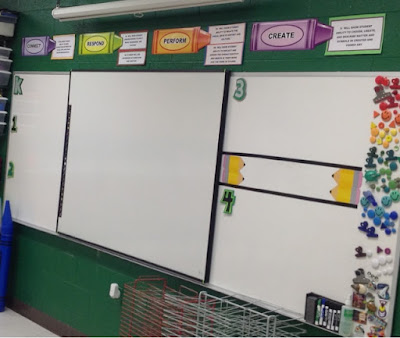
At what (x,y) coordinates should I click in order to perform the action: click on whtieboard. Please return your answer as a coordinate pair (x, y). This screenshot has width=400, height=338. Looking at the image, I should click on (146, 130), (32, 134), (297, 122).